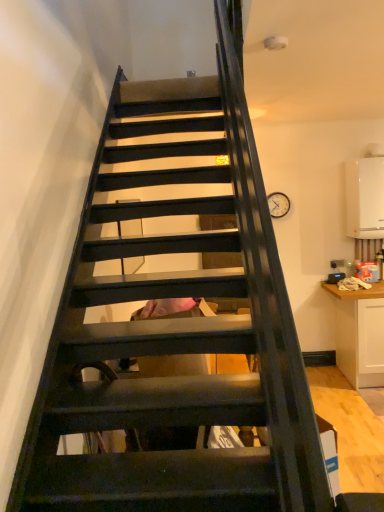
Question: Is white glossy boiler at upper right taller or shorter than cardboard box at center?

Choices:
 (A) tall
 (B) short

Answer: (A)

Question: Is white glossy boiler at upper right spatially inside cardboard box at center, or outside of it?

Choices:
 (A) inside
 (B) outside

Answer: (B)

Question: From the image's perspective, relative to cardboard box at center, is white glossy boiler at upper right above or below?

Choices:
 (A) above
 (B) below

Answer: (A)

Question: Is cardboard box at center inside or outside of white glossy boiler at upper right?

Choices:
 (A) inside
 (B) outside

Answer: (B)

Question: Is cardboard box at center in front of or behind white glossy boiler at upper right in the image?

Choices:
 (A) front
 (B) behind

Answer: (A)

Question: From a real-world perspective, is cardboard box at center above or below white glossy boiler at upper right?

Choices:
 (A) above
 (B) below

Answer: (B)

Question: Is point (322, 439) positioned closer to the camera than point (365, 233)?

Choices:
 (A) closer
 (B) farther

Answer: (A)